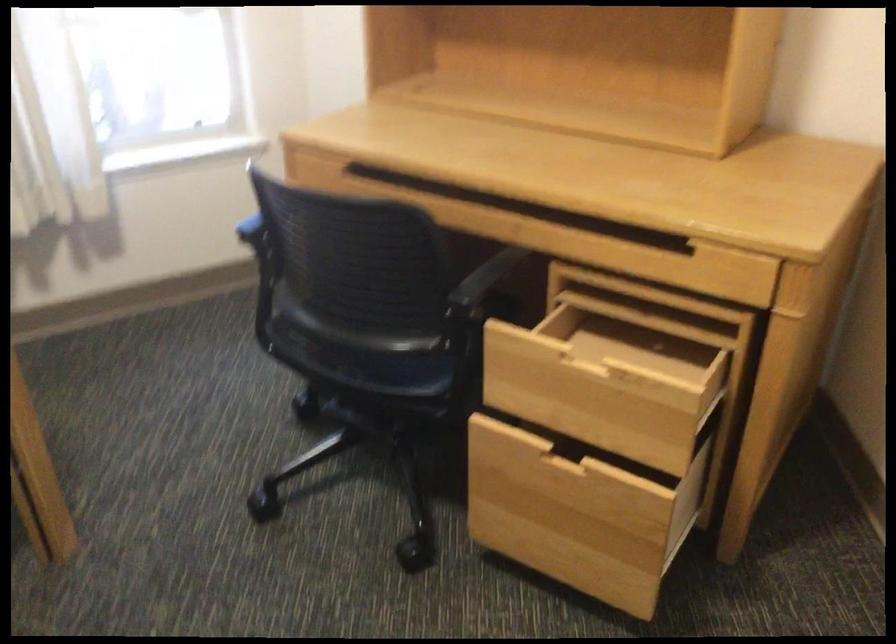
Describe the element at coordinates (485, 278) in the screenshot. This screenshot has width=896, height=644. I see `the black chair armrest` at that location.